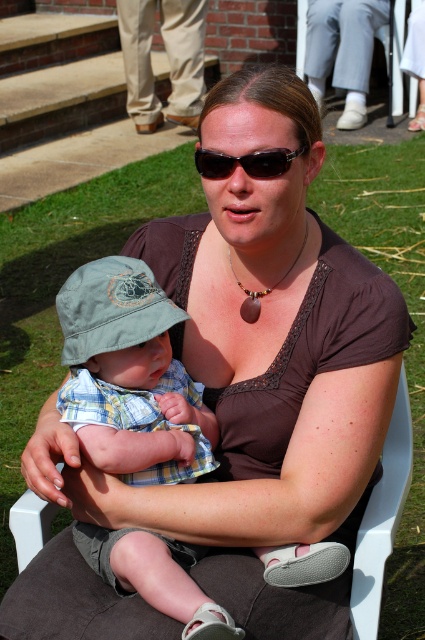
Question: Is black plastic sunglasses at center to the right of brown stone pendant at center from the viewer's perspective?

Choices:
 (A) no
 (B) yes

Answer: (A)

Question: Does black plastic sunglasses at center lie in front of brown stone pendant at center?

Choices:
 (A) no
 (B) yes

Answer: (B)

Question: Which is nearer to the white plastic chair at center?

Choices:
 (A) brown stone pendant at center
 (B) black plastic sunglasses at center

Answer: (A)

Question: Does black plastic sunglasses at center have a larger size compared to brown stone pendant at center?

Choices:
 (A) yes
 (B) no

Answer: (A)

Question: Which point is farther to the camera?

Choices:
 (A) white plastic chair at center
 (B) brown stone pendant at center

Answer: (B)

Question: Among these points, which one is nearest to the camera?

Choices:
 (A) (248, 305)
 (B) (79, 586)
 (C) (193, 156)

Answer: (B)